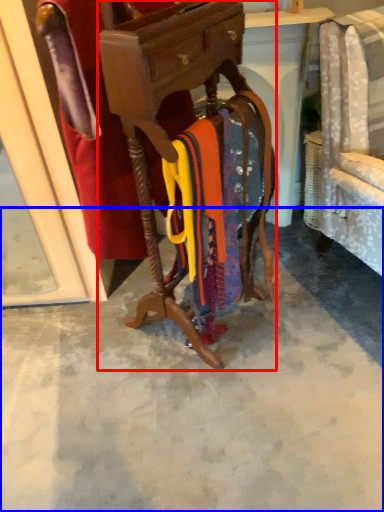
Question: Which object is closer to the camera taking this photo, furniture (highlighted by a red box) or concrete (highlighted by a blue box)?

Choices:
 (A) furniture
 (B) concrete

Answer: (A)